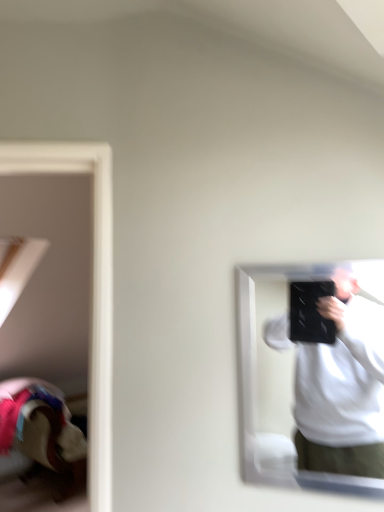
The width and height of the screenshot is (384, 512). Describe the element at coordinates (342, 388) in the screenshot. I see `white matte shirt at right` at that location.

Where is `white matte shirt at right`? This screenshot has width=384, height=512. white matte shirt at right is located at coordinates (342, 388).

I want to click on white matte shirt at right, so click(x=342, y=388).